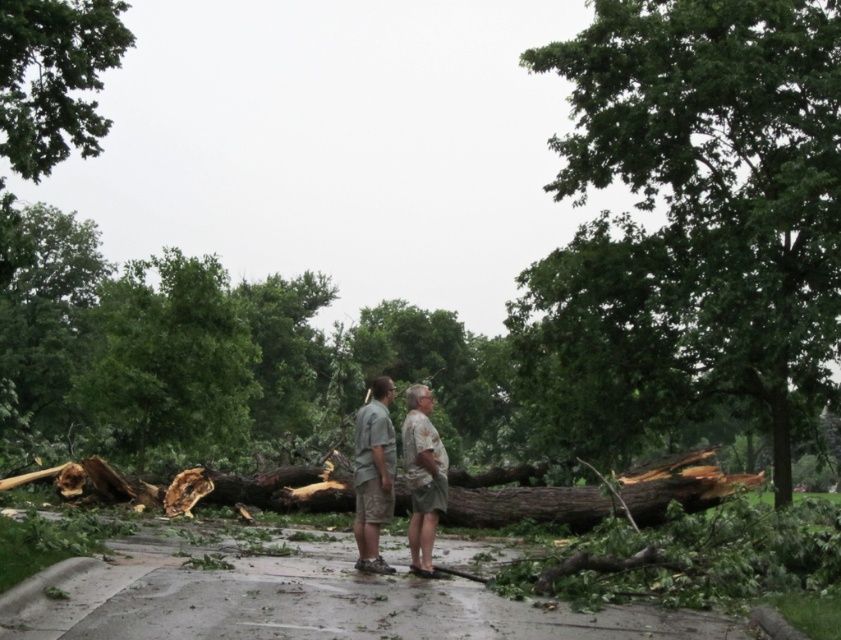
In the scene shown: Can you confirm if green rough bark tree at center is bigger than camouflage shorts at center?

Yes, green rough bark tree at center is bigger than camouflage shorts at center.

Based on the photo, can you confirm if green rough bark tree at center is wider than camouflage shorts at center?

Yes.

Does point (713, 205) come behind point (383, 474)?

Yes, it is.

Where is `green rough bark tree at center`? The width and height of the screenshot is (841, 640). green rough bark tree at center is located at coordinates (717, 193).

Is the position of camouflage fabric shorts at center more distant than that of camouflage shirt at center?

That is False.

Does point (424, 480) lie behind point (427, 532)?

Yes, point (424, 480) is farther from viewer.

Where is `camouflage fabric shorts at center`? The height and width of the screenshot is (640, 841). camouflage fabric shorts at center is located at coordinates (422, 477).

Does green rough bark tree at center have a lesser height compared to camouflage fabric shorts at center?

Incorrect, green rough bark tree at center's height does not fall short of camouflage fabric shorts at center's.

Who is shorter, green rough bark tree at center or camouflage fabric shorts at center?

camouflage fabric shorts at center is shorter.

Which is behind, point (833, 160) or point (421, 387)?

Point (833, 160)

The image size is (841, 640). Identify the location of green rough bark tree at center. (717, 193).